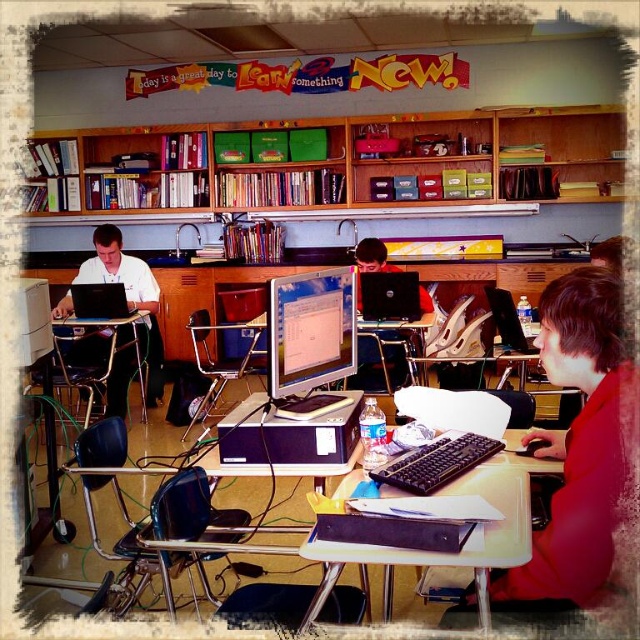
Question: In this image, where is wooden bookshelf at upper center located relative to matte black laptop at left?

Choices:
 (A) left
 (B) right

Answer: (B)

Question: Considering the real-world distances, which object is farthest from the black plastic keyboard at center?

Choices:
 (A) matte black monitor at center
 (B) red matte shirt at center

Answer: (A)

Question: Does black plastic keyboard at center have a lesser width compared to matte black laptop at left?

Choices:
 (A) no
 (B) yes

Answer: (A)

Question: Is matte black monitor at center smaller than matte white shirt at left?

Choices:
 (A) yes
 (B) no

Answer: (A)

Question: Which object appears closest to the camera in this image?

Choices:
 (A) matte black laptop at center
 (B) matte black laptop at left

Answer: (A)

Question: Which of the following is the closest to the observer?

Choices:
 (A) (548, 582)
 (B) (356, 422)
 (C) (358, 353)
 (D) (70, 314)

Answer: (A)